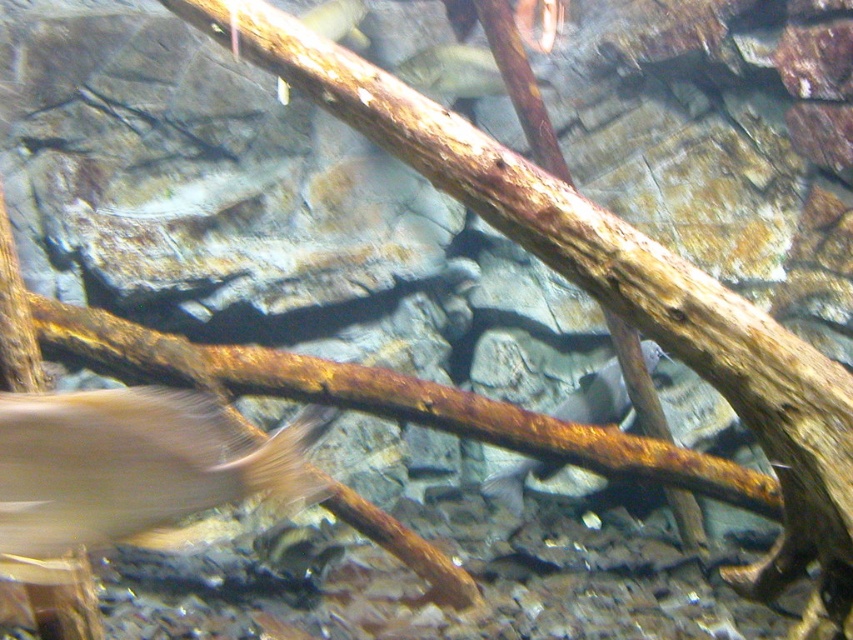
Who is lower down, translucent white fish at lower left or translucent white fish at center?

translucent white fish at lower left is below.

In the scene shown: Can you confirm if translucent white fish at lower left is positioned to the left of translucent white fish at center?

Indeed, translucent white fish at lower left is positioned on the left side of translucent white fish at center.

You are a GUI agent. You are given a task and a screenshot of the screen. Output one action in this format:
    pyautogui.click(x=<x>, y=<y>)
    Task: Click on the translucent white fish at lower left
    Image resolution: width=853 pixels, height=640 pixels.
    Given the screenshot: What is the action you would take?
    pyautogui.click(x=131, y=467)

Who is higher up, translucent white fish at lower left or silvery metallic fish at center?

translucent white fish at lower left

Between translucent white fish at lower left and silvery metallic fish at center, which one is positioned lower?

Positioned lower is silvery metallic fish at center.

Identify the location of translucent white fish at lower left. (131, 467).

Image resolution: width=853 pixels, height=640 pixels. In order to click on translucent white fish at lower left in this screenshot , I will do `click(131, 467)`.

Between point (494, 496) and point (415, 80), which one is positioned in front?

Positioned in front is point (494, 496).

Can you confirm if silvery metallic fish at center is positioned to the left of translucent white fish at center?

In fact, silvery metallic fish at center is to the right of translucent white fish at center.

Find the location of a particular element. The width and height of the screenshot is (853, 640). silvery metallic fish at center is located at coordinates (598, 400).

Find the location of a particular element. silvery metallic fish at center is located at coordinates (598, 400).